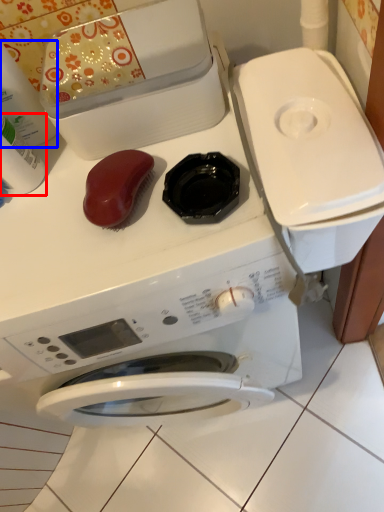
Question: Which point is closer to the camera, cleaning product (highlighted by a red box) or cleaning product (highlighted by a blue box)?

Choices:
 (A) cleaning product
 (B) cleaning product

Answer: (B)